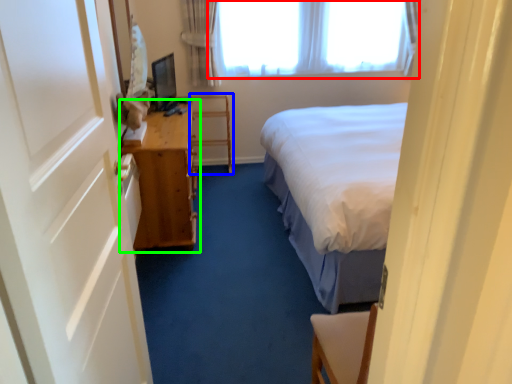
Question: Based on their relative distances, which object is nearer to window (highlighted by a red box)? Choose from furniture (highlighted by a blue box) and table (highlighted by a green box).

Choices:
 (A) furniture
 (B) table

Answer: (A)